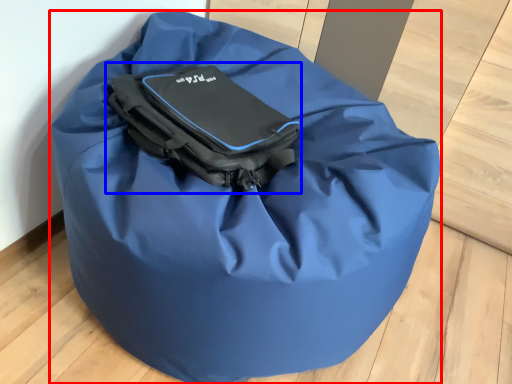
Question: Which object appears farthest to the camera in this image, luggage and bags (highlighted by a red box) or pack (highlighted by a blue box)?

Choices:
 (A) luggage and bags
 (B) pack

Answer: (B)